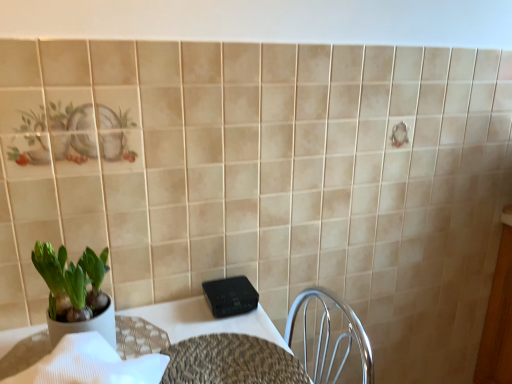
Question: Can you confirm if leather textured table at lower left is smaller than leopard print table at center?

Choices:
 (A) no
 (B) yes

Answer: (A)

Question: From the image's perspective, is leather textured table at lower left above leopard print table at center?

Choices:
 (A) yes
 (B) no

Answer: (A)

Question: Considering the relative sizes of leather textured table at lower left and leopard print table at center in the image provided, is leather textured table at lower left shorter than leopard print table at center?

Choices:
 (A) no
 (B) yes

Answer: (A)

Question: From a real-world perspective, is leather textured table at lower left under leopard print table at center?

Choices:
 (A) yes
 (B) no

Answer: (B)

Question: Could you tell me if leather textured table at lower left is turned towards leopard print table at center?

Choices:
 (A) yes
 (B) no

Answer: (B)

Question: Considering the relative positions of leather textured table at lower left and leopard print table at center in the image provided, is leather textured table at lower left to the left of leopard print table at center from the viewer's perspective?

Choices:
 (A) no
 (B) yes

Answer: (B)

Question: Does green matte pot at left have a greater height compared to leopard print table at center?

Choices:
 (A) yes
 (B) no

Answer: (A)

Question: Is green matte pot at left not inside leopard print table at center?

Choices:
 (A) yes
 (B) no

Answer: (A)

Question: Does green matte pot at left touch leopard print table at center?

Choices:
 (A) no
 (B) yes

Answer: (A)

Question: Does green matte pot at left have a larger size compared to leopard print table at center?

Choices:
 (A) yes
 (B) no

Answer: (A)

Question: Does green matte pot at left have a greater width compared to leopard print table at center?

Choices:
 (A) yes
 (B) no

Answer: (B)

Question: Does green matte pot at left have a smaller size compared to leopard print table at center?

Choices:
 (A) no
 (B) yes

Answer: (A)

Question: From a real-world perspective, is green matte pot at left beneath leather textured table at lower left?

Choices:
 (A) yes
 (B) no

Answer: (B)